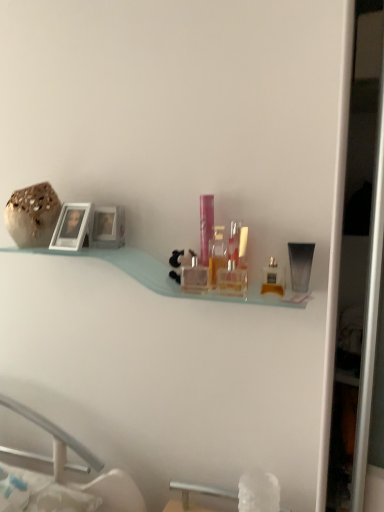
Question: Can you confirm if clear glass perfume bottle at center, the first toiletry viewed from the left, is shorter than translucent glass perfume bottle at center, arranged as the 6th toiletry when viewed from the right?

Choices:
 (A) yes
 (B) no

Answer: (A)

Question: Can you confirm if clear glass perfume bottle at center, the eighth toiletry in the right-to-left sequence, is thinner than translucent glass perfume bottle at center, arranged as the 6th toiletry when viewed from the right?

Choices:
 (A) yes
 (B) no

Answer: (A)

Question: Is translucent glass perfume bottle at center, arranged as the 6th toiletry when viewed from the right, at the back of clear glass perfume bottle at center, the first toiletry viewed from the left?

Choices:
 (A) no
 (B) yes

Answer: (A)

Question: Can you confirm if clear glass perfume bottle at center, the eighth toiletry in the right-to-left sequence, is smaller than translucent glass perfume bottle at center, the third toiletry positioned from the left?

Choices:
 (A) yes
 (B) no

Answer: (A)

Question: From a real-world perspective, is clear glass perfume bottle at center, the eighth toiletry in the right-to-left sequence, on translucent glass perfume bottle at center, the third toiletry positioned from the left?

Choices:
 (A) no
 (B) yes

Answer: (A)

Question: Does clear glass perfume bottle at center, the eighth toiletry in the right-to-left sequence, turn towards translucent glass perfume bottle at center, arranged as the 6th toiletry when viewed from the right?

Choices:
 (A) no
 (B) yes

Answer: (A)

Question: From a real-world perspective, is translucent glass perfume bottle at center, arranged as the 6th toiletry when viewed from the right, below matte silver picture frame at left?

Choices:
 (A) yes
 (B) no

Answer: (A)

Question: From the image's perspective, is translucent glass perfume bottle at center, arranged as the 6th toiletry when viewed from the right, below matte silver picture frame at left?

Choices:
 (A) no
 (B) yes

Answer: (B)

Question: Are translucent glass perfume bottle at center, arranged as the 6th toiletry when viewed from the right, and matte silver picture frame at left far apart?

Choices:
 (A) no
 (B) yes

Answer: (A)

Question: Is translucent glass perfume bottle at center, the third toiletry positioned from the left, facing away from matte silver picture frame at left?

Choices:
 (A) no
 (B) yes

Answer: (A)

Question: From a real-world perspective, does translucent glass perfume bottle at center, the third toiletry positioned from the left, stand above matte silver picture frame at left?

Choices:
 (A) no
 (B) yes

Answer: (A)

Question: Is translucent glass perfume bottle at center, the third toiletry positioned from the left, wider than matte silver picture frame at left?

Choices:
 (A) no
 (B) yes

Answer: (A)

Question: Is pink plastic container at center, which is the seventh toiletry from right to left, beside clear glass perfume bottle at center, which is the 4th toiletry in left-to-right order?

Choices:
 (A) yes
 (B) no

Answer: (B)